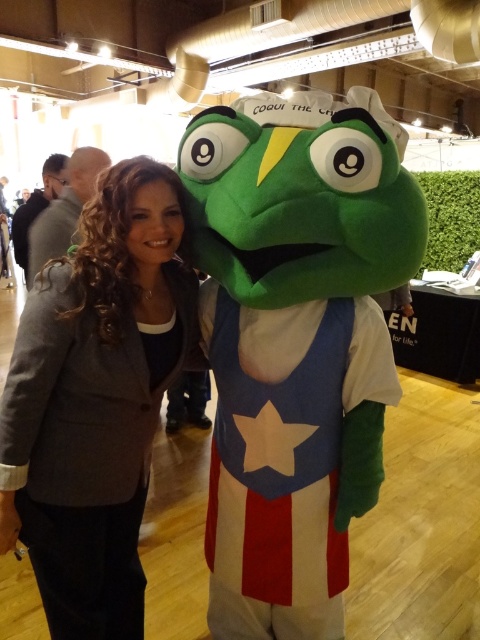
You are a photographer trying to capture a clear shot of both the matte gray blazer at center and the velvet green costume at center. Since both are at the center, which one will appear larger in your photo?

The matte gray blazer at center appears larger in the photo because it is closer to the viewer than the velvet green costume at center.

You are a fashion designer observing the scene. You need to decide which clothing item to place on a mannequin first based on their height. Which one should you place first, the matte gray blazer at center or the velvet green costume at center?

The matte gray blazer at center is much taller than the velvet green costume at center, so you should place the matte gray blazer at center first on the mannequin since it requires more vertical space.

You are a photographer setting up for a group photo. You notice the matte gray blazer at center and the velvet green costume at center in the frame. Based on their positions, which one is closer to the left edge of the photo?

The matte gray blazer at center is to the left of the velvet green costume at center, so it is closer to the left edge of the photo.